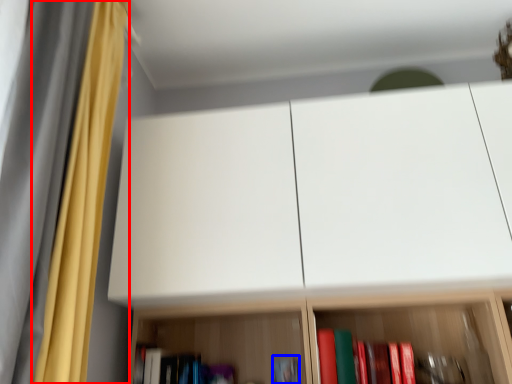
Question: Which object is further to the camera taking this photo, curtain (highlighted by a red box) or book (highlighted by a blue box)?

Choices:
 (A) curtain
 (B) book

Answer: (B)